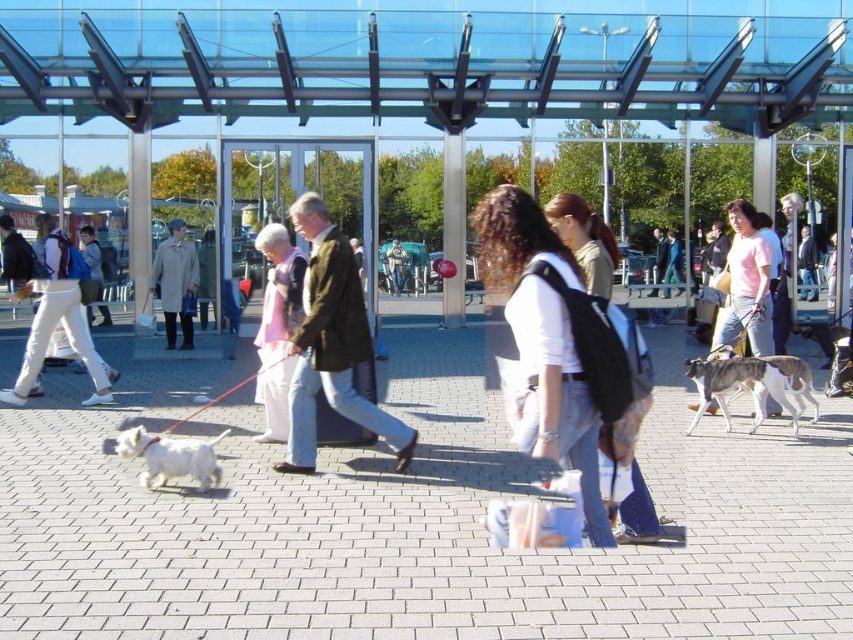
The height and width of the screenshot is (640, 853). What do you see at coordinates (738, 385) in the screenshot? I see `white fur dog at right` at bounding box center [738, 385].

Between point (706, 378) and point (169, 305), which one is positioned in front?

Positioned in front is point (706, 378).

Find the location of a particular element. The width and height of the screenshot is (853, 640). white fur dog at right is located at coordinates (738, 385).

You are a GUI agent. You are given a task and a screenshot of the screen. Output one action in this format:
    pyautogui.click(x=<x>, y=<y>)
    Task: Click on the white matte backpack at center
    The width and height of the screenshot is (853, 640).
    Given the screenshot: What is the action you would take?
    pyautogui.click(x=553, y=342)

Can you confirm if white matte backpack at center is wider than pink cotton t-shirt at center?

Indeed, white matte backpack at center has a greater width compared to pink cotton t-shirt at center.

Does point (509, 252) come in front of point (746, 316)?

Yes.

The image size is (853, 640). What are the coordinates of `white matte backpack at center` in the screenshot? It's located at (553, 342).

Does white brick pavement at center appear on the right side of pink cotton t-shirt at center?

In fact, white brick pavement at center is to the left of pink cotton t-shirt at center.

Which is more to the left, white brick pavement at center or pink cotton t-shirt at center?

From the viewer's perspective, white brick pavement at center appears more on the left side.

Is point (91, 556) positioned in front of point (734, 272)?

Yes.

This screenshot has width=853, height=640. What are the coordinates of `white brick pavement at center` in the screenshot? It's located at (412, 524).